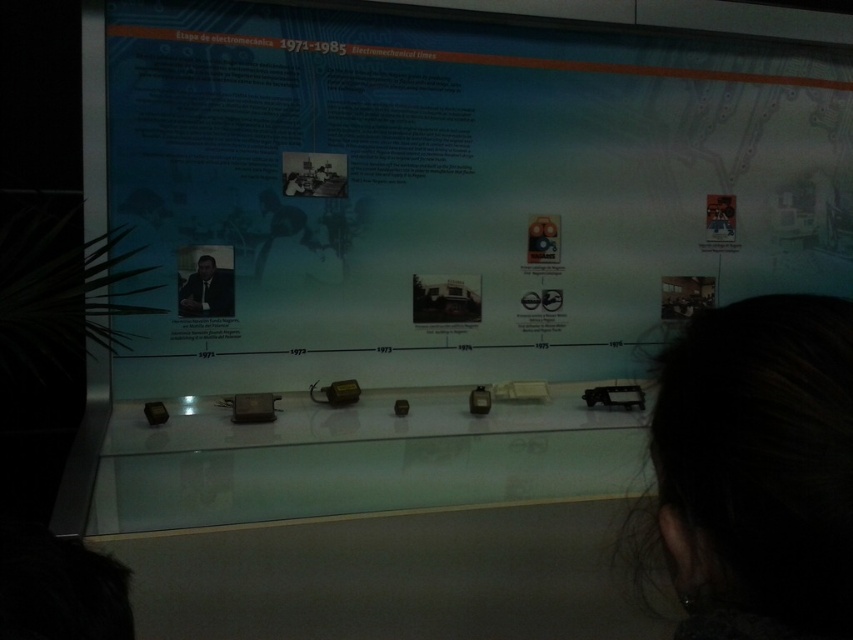
Does point (663, 561) come in front of point (204, 253)?

Yes, point (663, 561) is in front of point (204, 253).

The height and width of the screenshot is (640, 853). Identify the location of dark brown hair at upper right. (753, 472).

Does point (692, 243) lie behind point (688, 620)?

Yes, it is behind point (688, 620).

Who is more distant from viewer, (456, 28) or (744, 403)?

Point (456, 28)

At what (x,y) coordinates should I click in order to perform the action: click on matte blue poster at center. Please return your answer as a coordinate pair (x, y). Looking at the image, I should click on (457, 192).

Consider the image. Is matte blue poster at center above matte black suit at center?

Correct, matte blue poster at center is located above matte black suit at center.

Can you confirm if matte blue poster at center is positioned to the right of matte black suit at center?

Correct, you'll find matte blue poster at center to the right of matte black suit at center.

Identify the location of matte blue poster at center. The height and width of the screenshot is (640, 853). (457, 192).

In order to click on matte blue poster at center in this screenshot , I will do `click(457, 192)`.